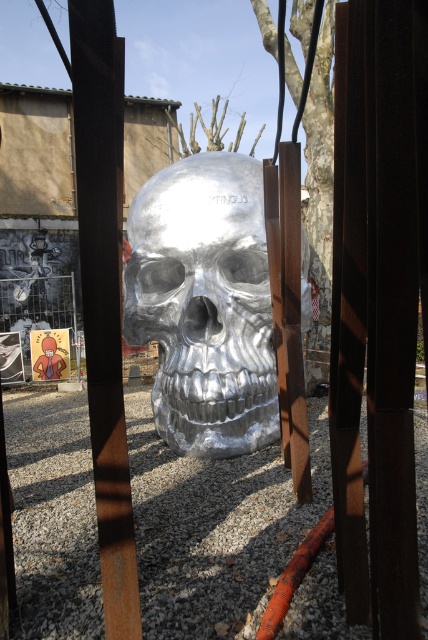
Between shiny metallic skull at center and brushed metal fence at center, which one is positioned lower?

shiny metallic skull at center is lower down.

Where is `shiny metallic skull at center`? The width and height of the screenshot is (428, 640). shiny metallic skull at center is located at coordinates (205, 304).

Which is in front, point (318, 536) or point (62, 362)?

Point (318, 536) is in front.

The width and height of the screenshot is (428, 640). What are the coordinates of `orange rubber hose at center` in the screenshot? It's located at (294, 576).

Is shiny metallic skull at center bigger than rusty metal pole at center?

Yes, shiny metallic skull at center is bigger than rusty metal pole at center.

Between shiny metallic skull at center and rusty metal pole at center, which one is positioned lower?

rusty metal pole at center is lower down.

The height and width of the screenshot is (640, 428). What do you see at coordinates (205, 304) in the screenshot?
I see `shiny metallic skull at center` at bounding box center [205, 304].

Image resolution: width=428 pixels, height=640 pixels. What are the coordinates of `shiny metallic skull at center` in the screenshot? It's located at (205, 304).